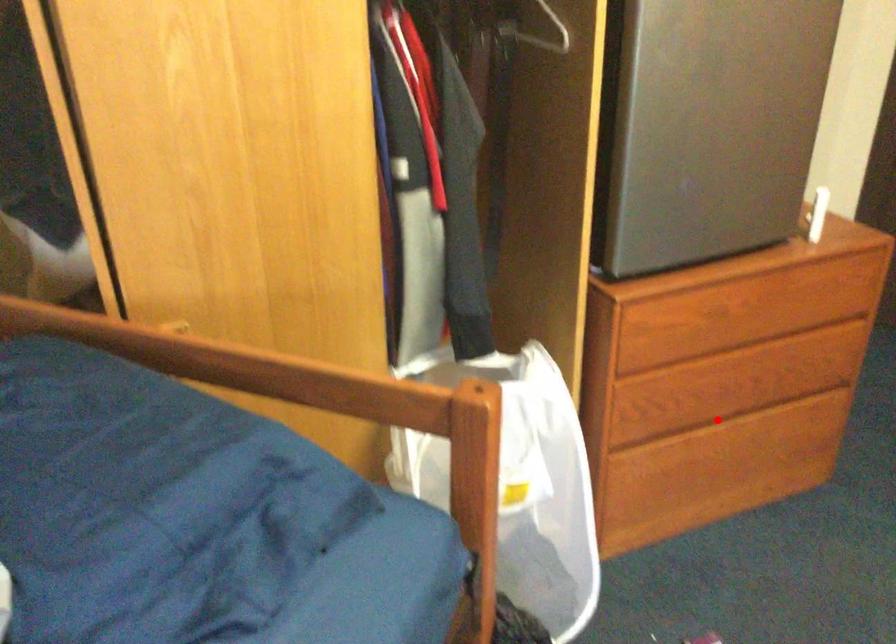
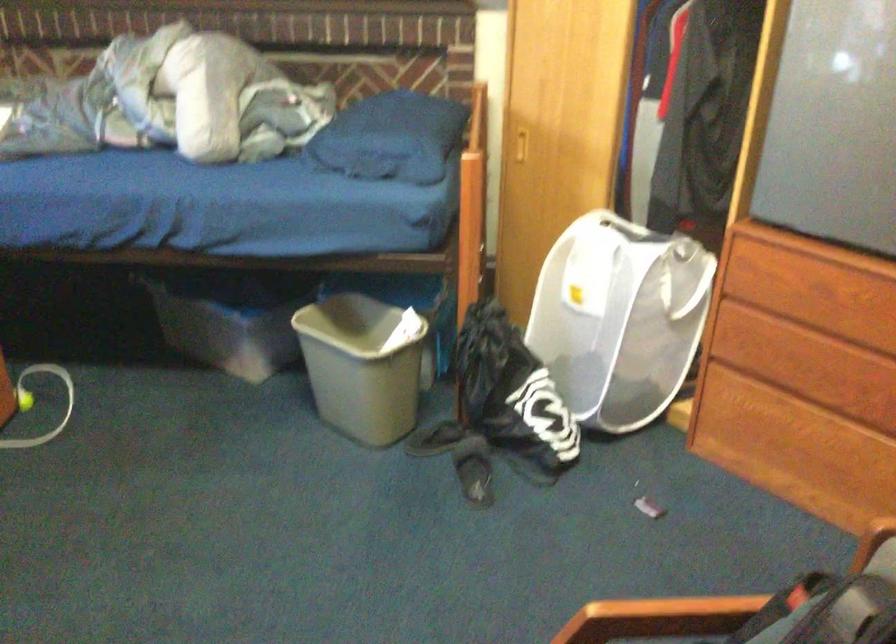
Where in the second image is the point corresponding to the highlighted location from the first image?

(819, 413)